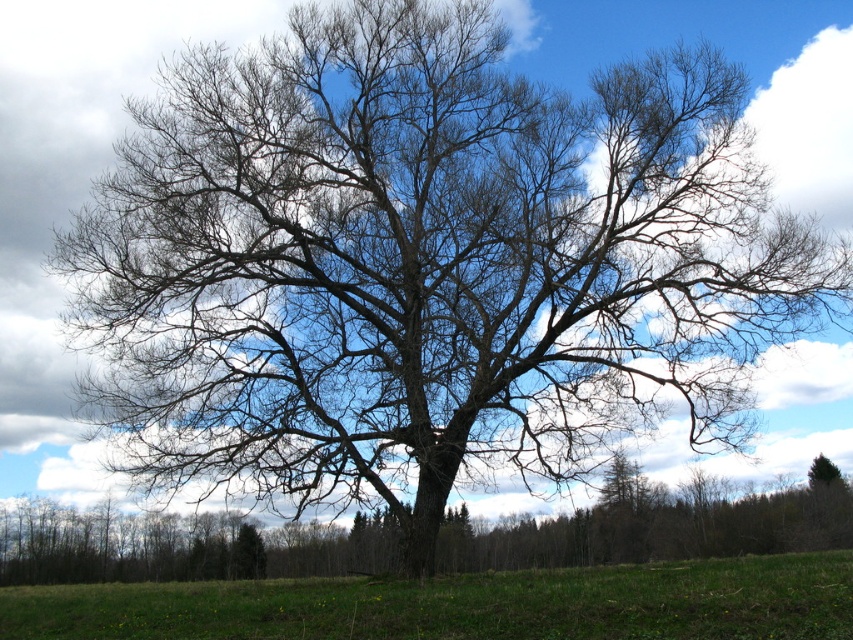
You are planning to plant a new tree in your backyard. The area where you want to plant it has a green grassy field at center and a bare wood tree at center. Based on the image, which one takes up more space?

The green grassy field at center is bigger than the bare wood tree at center, so the grassy field takes up more space.

You are a hiker standing at the edge of the green grassy field at center and want to reach the bare wood tree at center. Which direction should you walk to get closer to the tree?

The green grassy field at center is in front of the bare wood tree at center, so you should walk forward towards the tree to get closer.

You are standing at the point labeled as point (463,604) in the image. What type of terrain are you currently standing on?

The point (463,604) is on green grassy field at center, so you are standing on a green grassy field.